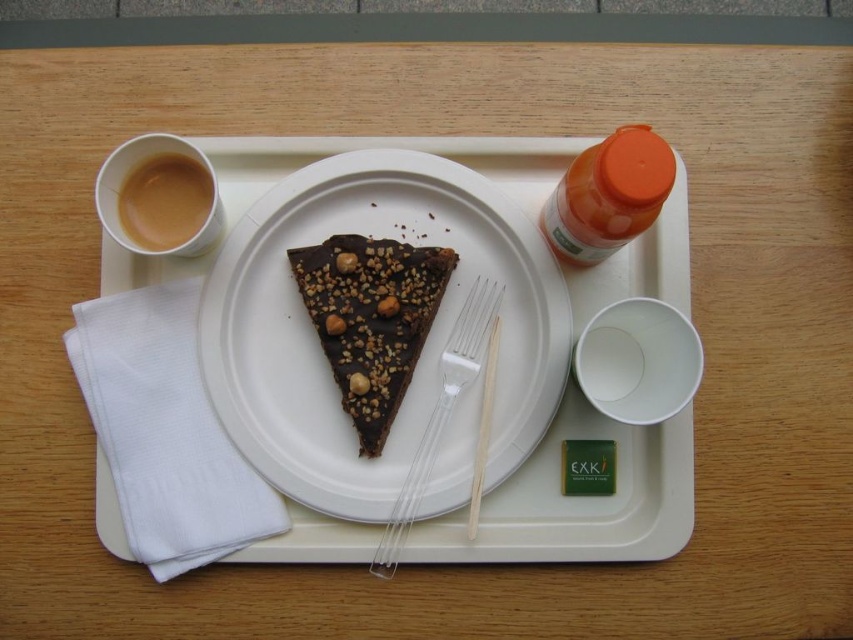
You are a waiter delivering a meal tray to a guest. The guest asks you to describe the position of the chocolatecrumblyslice at center relative to the orange matte bottle at upper right. How would you describe it?

The chocolatecrumblyslice at center is located below the orange matte bottle at upper right.

You are a delivery robot that needs to pick up the transparent plastic fork at center from the meal tray. What are the coordinates where you should move your arm to retrieve it?

The transparent plastic fork at center is located at coordinates point (447, 412), so you should move your arm to that position to retrieve it.

You are looking at the meal tray from above. There are two points marked on the tray. One is at coordinate point [445,272] and the other is at point [612,216]. Which point is closer to you?

Point [445,272] is closer to you because it is further to the camera than point [612,216].